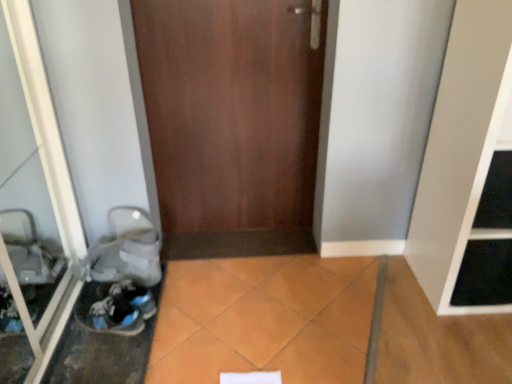
Question: Is blue suede sneakers at lower left bigger or smaller than white matte shelf at right?

Choices:
 (A) small
 (B) big

Answer: (A)

Question: Would you say blue suede sneakers at lower left is to the left or to the right of white matte shelf at right in the picture?

Choices:
 (A) left
 (B) right

Answer: (A)

Question: Which object is positioned closest to the white matte shelf at right?

Choices:
 (A) transparent glass door at left
 (B) wooden door at center
 (C) blue suede sneakers at lower left

Answer: (B)

Question: Estimate the real-world distances between objects in this image. Which object is closer to the transparent glass door at left?

Choices:
 (A) white matte shelf at right
 (B) wooden door at center
 (C) blue suede sneakers at lower left

Answer: (C)